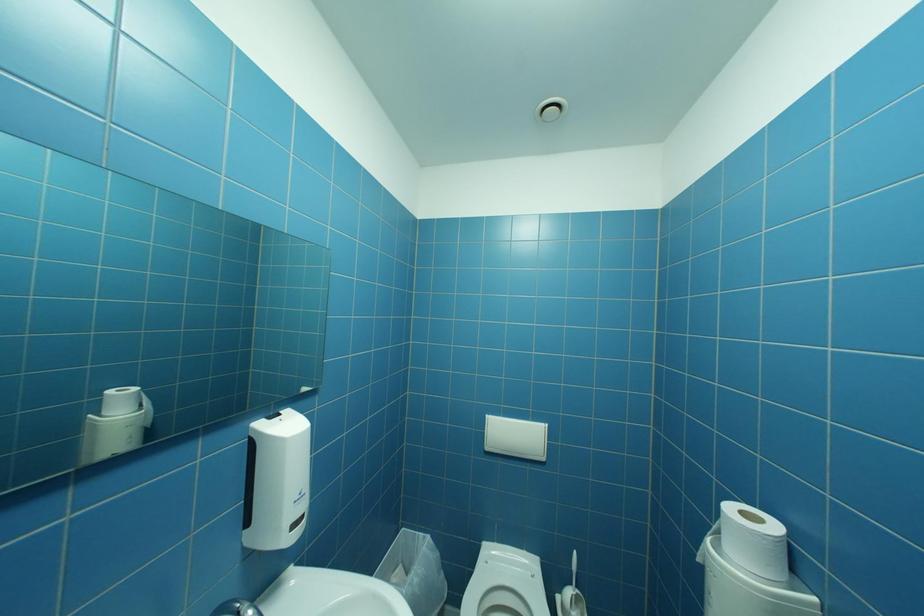
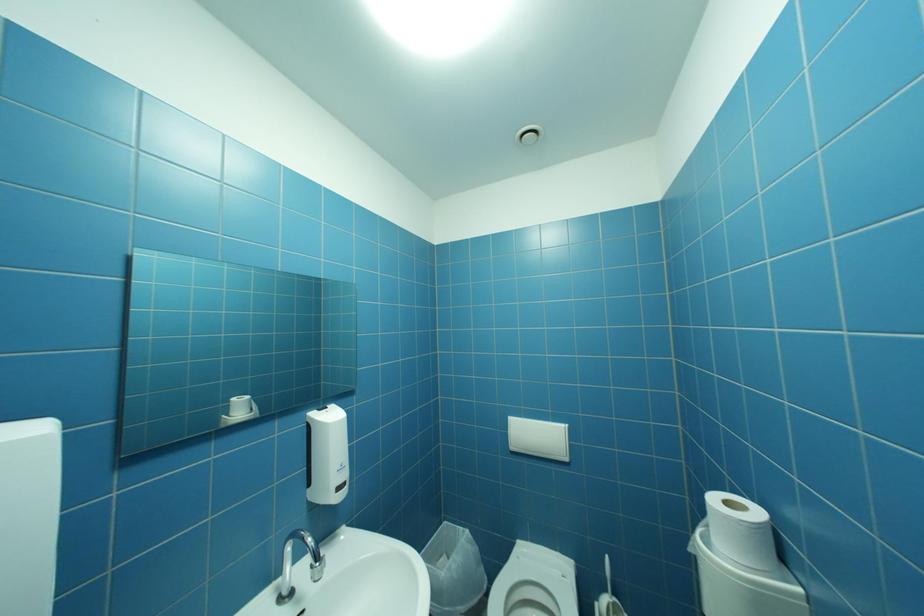
What movement of the cameraman would produce the second image?

The movement direction of the cameraman is right, backward.